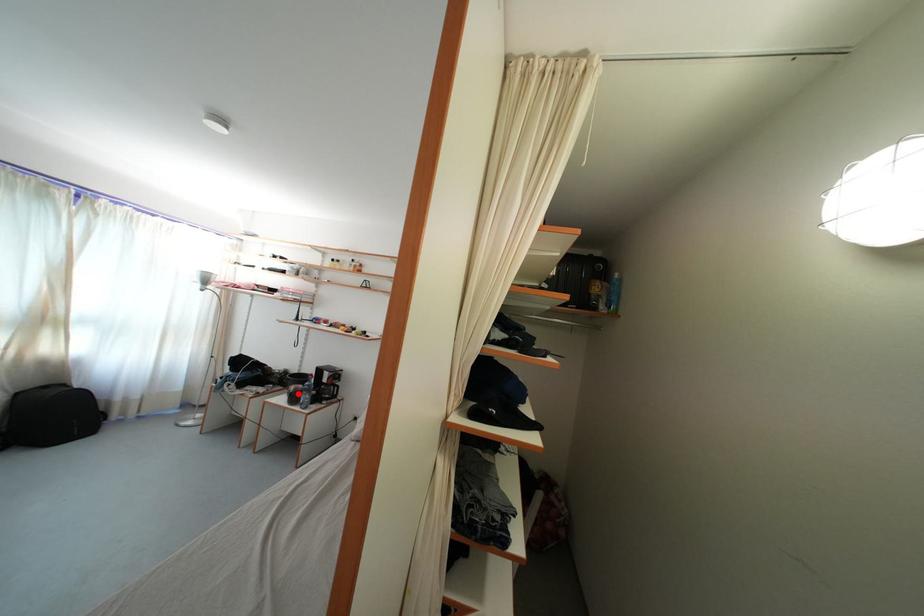
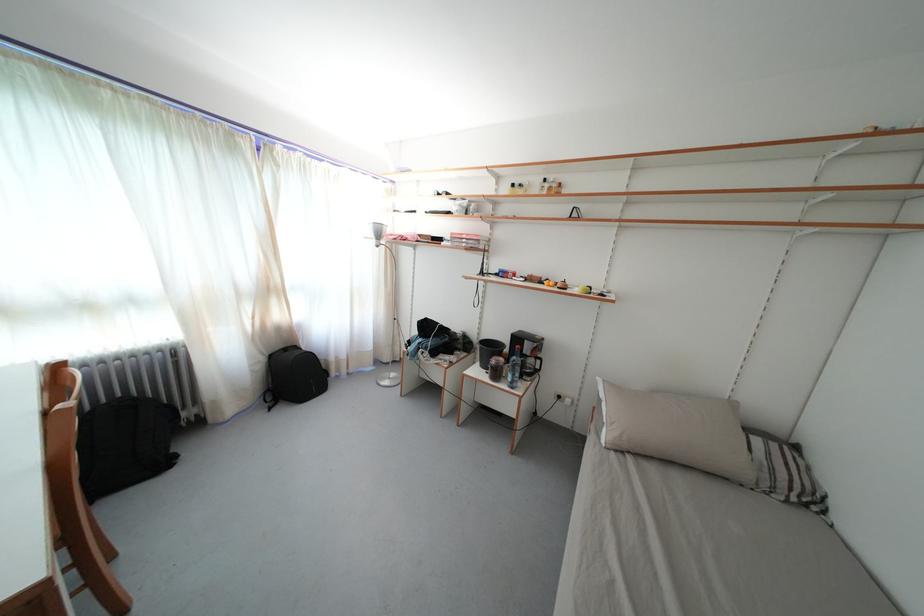
The point at the highlighted location is marked in the first image. Where is the corresponding point in the second image?

(499, 367)